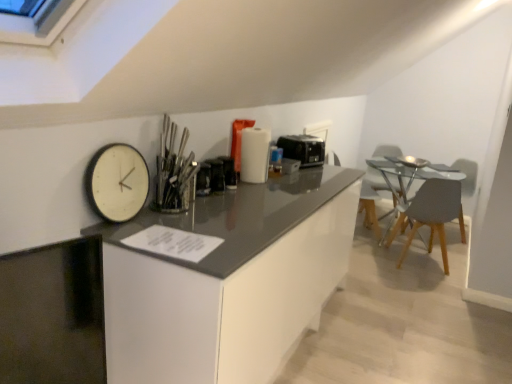
This screenshot has height=384, width=512. In order to click on vacant region to the right of white matte clock at left in this screenshot , I will do `click(168, 226)`.